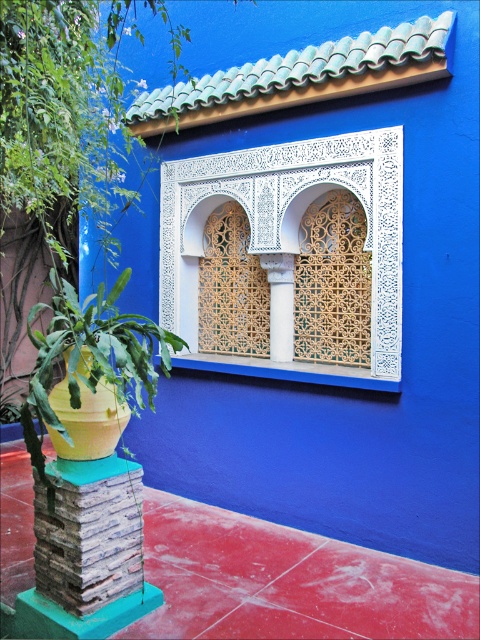
Question: Is white lattice window at center below white stone column at center?

Choices:
 (A) no
 (B) yes

Answer: (A)

Question: Where is white lattice window at center located in relation to white stone column at center in the image?

Choices:
 (A) right
 (B) left

Answer: (B)

Question: Which object appears farthest from the camera in this image?

Choices:
 (A) white stone column at center
 (B) white lattice window at center

Answer: (A)

Question: Which of the following is the closest to the observer?

Choices:
 (A) (292, 308)
 (B) (315, 161)

Answer: (B)

Question: Does white lattice window at center come in front of white stone column at center?

Choices:
 (A) yes
 (B) no

Answer: (A)